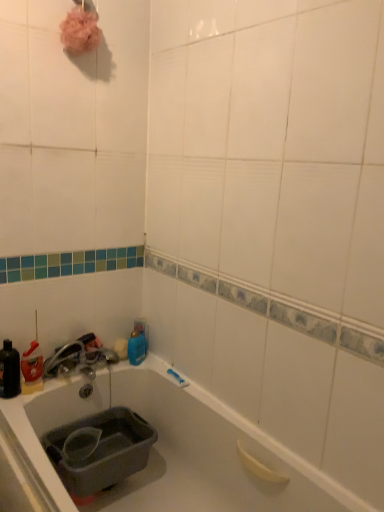
Question: From a real-world perspective, is gray plastic sink at lower left under satin nickel faucet at lower left?

Choices:
 (A) yes
 (B) no

Answer: (A)

Question: Could you tell me if gray plastic sink at lower left is facing satin nickel faucet at lower left?

Choices:
 (A) no
 (B) yes

Answer: (A)

Question: Is gray plastic sink at lower left thinner than satin nickel faucet at lower left?

Choices:
 (A) no
 (B) yes

Answer: (A)

Question: From the image's perspective, is gray plastic sink at lower left under satin nickel faucet at lower left?

Choices:
 (A) yes
 (B) no

Answer: (A)

Question: Is gray plastic sink at lower left next to satin nickel faucet at lower left and touching it?

Choices:
 (A) no
 (B) yes

Answer: (A)

Question: From a real-world perspective, is matte black bottle at left, which appears as the second bottle when viewed from the right, physically located above or below gray plastic sink at lower left?

Choices:
 (A) below
 (B) above

Answer: (B)

Question: From their relative heights in the image, would you say matte black bottle at left, which ranks as the second bottle in back-to-front order, is taller or shorter than gray plastic sink at lower left?

Choices:
 (A) short
 (B) tall

Answer: (B)

Question: Does point (9, 367) appear closer or farther from the camera than point (84, 423)?

Choices:
 (A) closer
 (B) farther

Answer: (A)

Question: Looking at their shapes, would you say matte black bottle at left, which appears as the second bottle when viewed from the right, is wider or thinner than gray plastic sink at lower left?

Choices:
 (A) thin
 (B) wide

Answer: (A)

Question: Considering the positions of blue glossy bottle at upper center, which is counted as the 1th bottle, starting from the back, and satin nickel faucet at lower left in the image, is blue glossy bottle at upper center, which is counted as the 1th bottle, starting from the back, taller or shorter than satin nickel faucet at lower left?

Choices:
 (A) tall
 (B) short

Answer: (B)

Question: From a real-world perspective, relative to satin nickel faucet at lower left, is blue glossy bottle at upper center, which is counted as the 1th bottle, starting from the back, vertically above or below?

Choices:
 (A) above
 (B) below

Answer: (B)

Question: Considering their positions, is blue glossy bottle at upper center, which is counted as the 1th bottle, starting from the back, located in front of or behind satin nickel faucet at lower left?

Choices:
 (A) front
 (B) behind

Answer: (B)

Question: Is blue glossy bottle at upper center, which is counted as the 1th bottle, starting from the back, situated inside satin nickel faucet at lower left or outside?

Choices:
 (A) inside
 (B) outside

Answer: (B)

Question: Considering the positions of point (66, 359) and point (135, 326), is point (66, 359) closer or farther from the camera than point (135, 326)?

Choices:
 (A) farther
 (B) closer

Answer: (B)

Question: In the image, is satin nickel faucet at lower left positioned in front of or behind blue glossy bottle at upper center, placed as the 2th bottle when sorted from front to back?

Choices:
 (A) behind
 (B) front

Answer: (B)